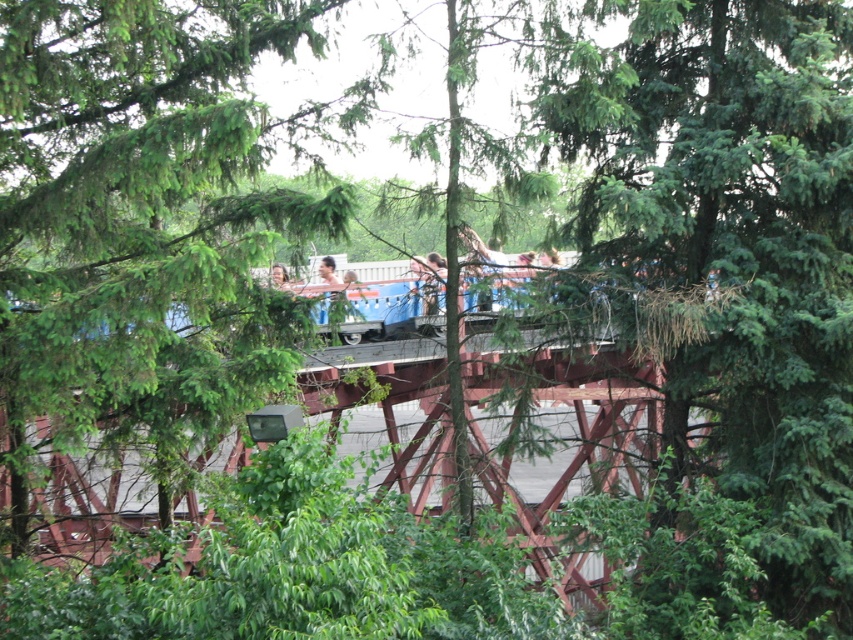
Question: Which of the following is the farthest from the observer?

Choices:
 (A) (729, 458)
 (B) (332, 268)

Answer: (B)

Question: Estimate the real-world distances between objects in this image. Which object is closer to the green leafy tree at center?

Choices:
 (A) smooth brown hair at center
 (B) green leafy tree at upper center

Answer: (B)

Question: Based on their relative distances, which object is nearer to the green leafy tree at center?

Choices:
 (A) metallic red bridge at center
 (B) green leafy tree at upper center

Answer: (A)

Question: Is metallic red bridge at center positioned before smooth skin face at center?

Choices:
 (A) yes
 (B) no

Answer: (A)

Question: Does smooth brown hair at center appear over smooth skin face at center?

Choices:
 (A) yes
 (B) no

Answer: (A)

Question: Does green leafy tree at upper center appear under metallic red bridge at center?

Choices:
 (A) no
 (B) yes

Answer: (A)